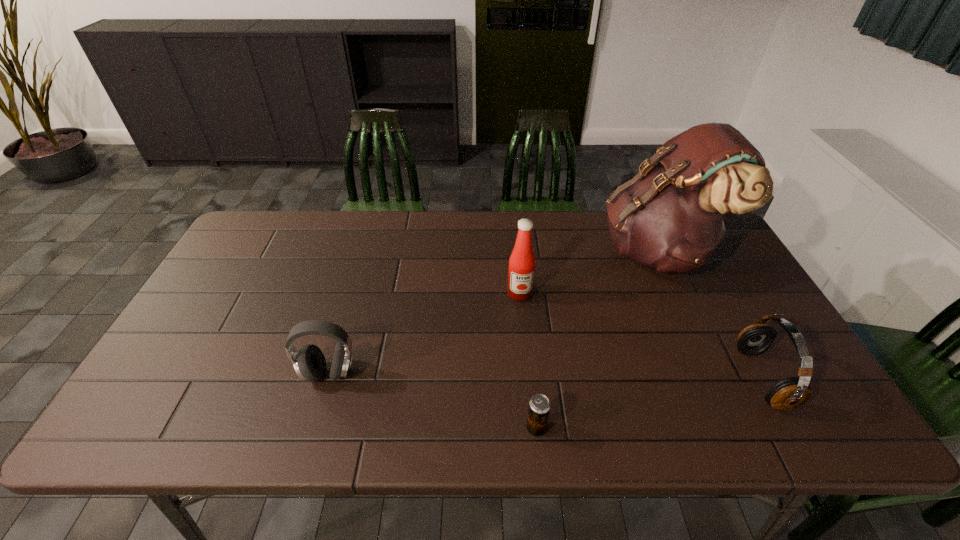
The height and width of the screenshot is (540, 960). In order to click on free spot that satisfies the following two spatial constraints: 1. at the front of the satchel with buckles; 2. on the front-facing side of the fourth shortest object in this screenshot , I will do `click(677, 293)`.